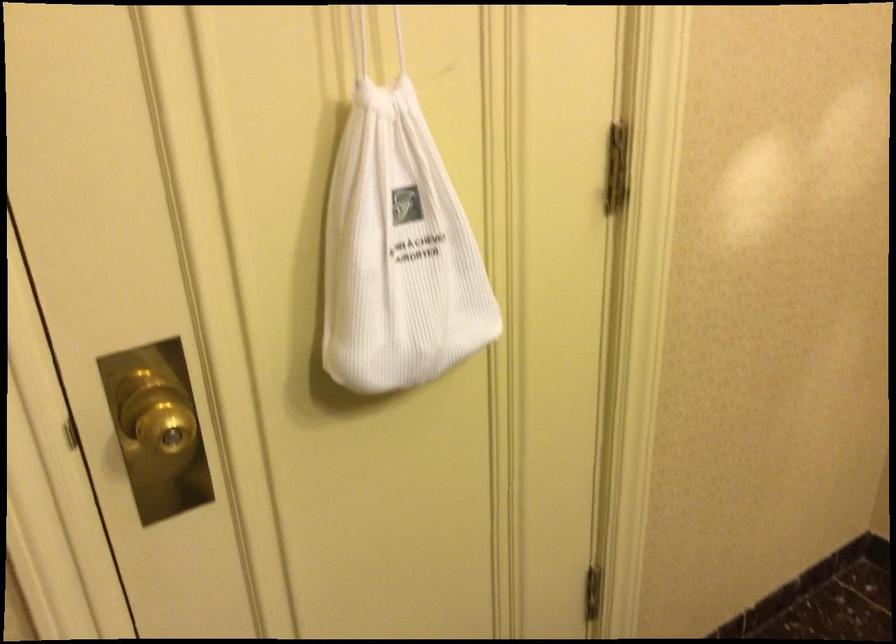
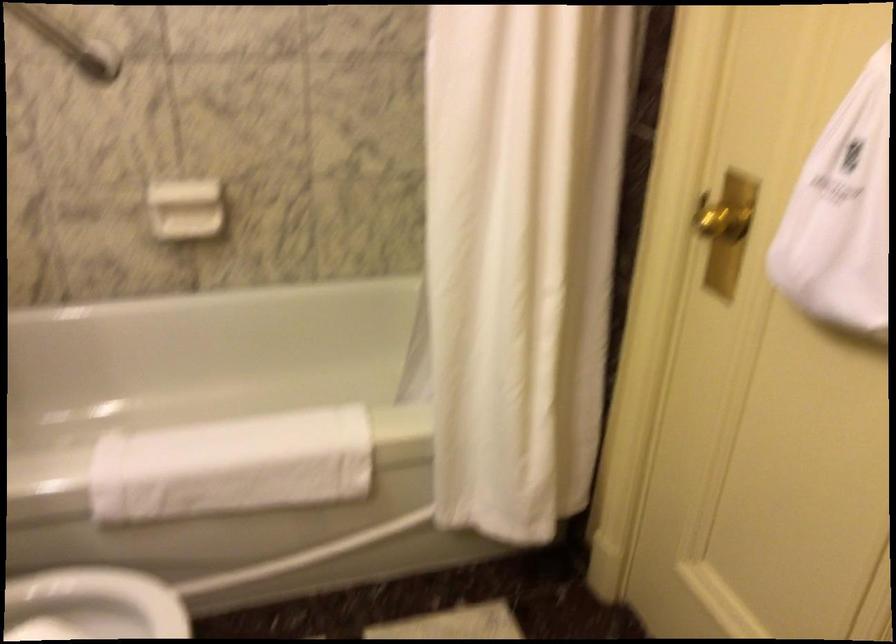
Find the pixel in the second image that matches (x=152, y=448) in the first image.

(722, 222)